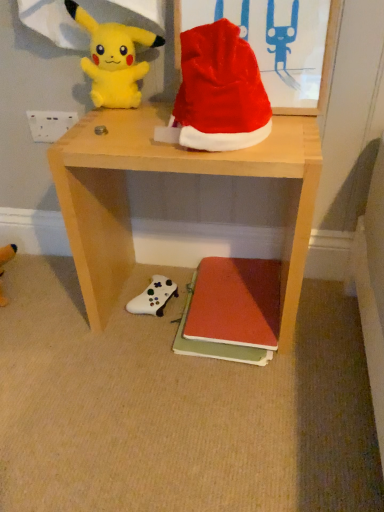
This screenshot has width=384, height=512. What do you see at coordinates (113, 59) in the screenshot? I see `yellow plush toy at upper left, placed as the 1th toy when sorted from front to back` at bounding box center [113, 59].

Describe the element at coordinates (220, 91) in the screenshot. The height and width of the screenshot is (512, 384). I see `shiny fabric santa hat at upper center` at that location.

Measure the distance between point [159,157] and camera.

The distance of point [159,157] from camera is 30.51 inches.

What do you see at coordinates (153, 297) in the screenshot?
I see `white matte game controller at lower center, acting as the second toy starting from the front` at bounding box center [153, 297].

At what (x,y) coordinates should I click in order to perform the action: click on yellow plush toy at upper left, marked as the 1th toy in a top-to-bottom arrangement. Please return your answer as a coordinate pair (x, y). This screenshot has height=512, width=384. Looking at the image, I should click on (113, 59).

Locate an element on the screen. The width and height of the screenshot is (384, 512). book behind the wooden desk at center is located at coordinates (231, 311).

Considering the sizes of wooden desk at center and matte red book at lower center in the image, is wooden desk at center taller or shorter than matte red book at lower center?

In the image, wooden desk at center appears to be taller than matte red book at lower center.

Considering the positions of point (103, 214) and point (278, 303), is point (103, 214) closer or farther from the camera than point (278, 303)?

Point (103, 214) is positioned closer to the camera compared to point (278, 303).

Does wooden desk at center have a smaller size compared to matte red book at lower center?

No, wooden desk at center is not smaller than matte red book at lower center.

Where is `desk in front of the matte red book at lower center`? The width and height of the screenshot is (384, 512). desk in front of the matte red book at lower center is located at coordinates (172, 172).

Does matte red book at lower center have a larger size compared to wooden desk at center?

No.

In the scene shown: Does matte red book at lower center come behind wooden desk at center?

Yes.

Which of these two, matte red book at lower center or wooden desk at center, stands shorter?

Standing shorter between the two is matte red book at lower center.

Are white plastic power outlet at upper left and matte red book at lower center far apart?

No.

Which object is positioned more to the right, white plastic power outlet at upper left or matte red book at lower center?

matte red book at lower center.

Is white plastic power outlet at upper left taller or shorter than matte red book at lower center?

white plastic power outlet at upper left is taller than matte red book at lower center.

Can you confirm if wooden desk at center is smaller than white plastic power outlet at upper left?

No, wooden desk at center is not smaller than white plastic power outlet at upper left.

From the picture: Is wooden desk at center next to white plastic power outlet at upper left and touching it?

No, wooden desk at center is not touching white plastic power outlet at upper left.

Is wooden desk at center aimed at white plastic power outlet at upper left?

No, wooden desk at center is not oriented towards white plastic power outlet at upper left.

This screenshot has height=512, width=384. In the image, there is a white plastic power outlet at upper left. What are the coordinates of `desk below it (from a real-world perspective)` in the screenshot? It's located at click(172, 172).

From the picture: Would you consider wooden desk at center to be distant from yellow plush toy at upper left, marked as the 1th toy in a top-to-bottom arrangement?

No.

Which object is closer to the camera taking this photo, wooden desk at center or yellow plush toy at upper left, placed as the 1th toy when sorted from front to back?

wooden desk at center is in front.

From a real-world perspective, does wooden desk at center sit lower than yellow plush toy at upper left, acting as the 2th toy starting from the bottom?

Indeed, from a real-world perspective, wooden desk at center is positioned beneath yellow plush toy at upper left, acting as the 2th toy starting from the bottom.

Is white plastic power outlet at upper left positioned with its back to white matte game controller at lower center, which ranks as the first toy in bottom-to-top order?

No.

Measure the distance between white plastic power outlet at upper left and white matte game controller at lower center, acting as the second toy starting from the front.

white plastic power outlet at upper left is 19.68 inches from white matte game controller at lower center, acting as the second toy starting from the front.

From the image's perspective, which is below, white plastic power outlet at upper left or white matte game controller at lower center, positioned as the 2th toy in top-to-bottom order?

white matte game controller at lower center, positioned as the 2th toy in top-to-bottom order.

Are white plastic power outlet at upper left and white matte game controller at lower center, which ranks as the first toy in bottom-to-top order, located far from each other?

Actually, white plastic power outlet at upper left and white matte game controller at lower center, which ranks as the first toy in bottom-to-top order, are a little close together.

Is white matte game controller at lower center, which ranks as the first toy in bottom-to-top order, beside wooden desk at center?

No.

Which of these two, white matte game controller at lower center, acting as the second toy starting from the front, or wooden desk at center, is wider?

Wider between the two is wooden desk at center.

Considering the relative sizes of white matte game controller at lower center, which ranks as the first toy in bottom-to-top order, and wooden desk at center in the image provided, is white matte game controller at lower center, which ranks as the first toy in bottom-to-top order, bigger than wooden desk at center?

No.

Is wooden desk at center completely or partially inside white matte game controller at lower center, which ranks as the first toy in bottom-to-top order?

No.

This screenshot has width=384, height=512. Find the location of `book on the right of wooden desk at center`. book on the right of wooden desk at center is located at coordinates (231, 311).

Identify the location of desk above the matte red book at lower center (from a real-world perspective). (172, 172).

When comparing their distances from shiny fabric santa hat at upper center, does white plastic power outlet at upper left or matte red book at lower center seem further?

Among the two, matte red book at lower center is located further to shiny fabric santa hat at upper center.

Consider the image. Based on their spatial positions, is wooden desk at center or shiny fabric santa hat at upper center closer to yellow plush toy at upper left, acting as the 2th toy starting from the bottom?

Among the two, shiny fabric santa hat at upper center is located nearer to yellow plush toy at upper left, acting as the 2th toy starting from the bottom.

Estimate the real-world distances between objects in this image. Which object is closer to yellow plush toy at upper left, acting as the 2th toy starting from the bottom, white plastic power outlet at upper left or matte red book at lower center?

Among the two, white plastic power outlet at upper left is located nearer to yellow plush toy at upper left, acting as the 2th toy starting from the bottom.

Based on their spatial positions, is wooden desk at center or yellow plush toy at upper left, marked as the 1th toy in a top-to-bottom arrangement, closer to matte red book at lower center?

wooden desk at center is positioned closer to the anchor matte red book at lower center.

Consider the image. Looking at the image, which one is located closer to white matte game controller at lower center, acting as the first toy starting from the back, wooden desk at center or yellow plush toy at upper left, marked as the 1th toy in a top-to-bottom arrangement?

Among the two, wooden desk at center is located nearer to white matte game controller at lower center, acting as the first toy starting from the back.

When comparing their distances from matte red book at lower center, does yellow plush toy at upper left, placed as the 1th toy when sorted from front to back, or wooden desk at center seem closer?

Among the two, wooden desk at center is located nearer to matte red book at lower center.

From the image, which object appears to be farther from yellow plush toy at upper left, marked as the 1th toy in a top-to-bottom arrangement, white matte game controller at lower center, acting as the second toy starting from the front, or matte red book at lower center?

matte red book at lower center.

Considering their positions, is yellow plush toy at upper left, acting as the 2th toy starting from the bottom, positioned closer to matte red book at lower center than white plastic power outlet at upper left?

yellow plush toy at upper left, acting as the 2th toy starting from the bottom, is positioned closer to the anchor matte red book at lower center.

Identify the location of toy between yellow plush toy at upper left, placed as the 1th toy when sorted from front to back, and matte red book at lower center from top to bottom. This screenshot has width=384, height=512. (153, 297).

Locate an element on the screen. This screenshot has width=384, height=512. hat between yellow plush toy at upper left, acting as the 2th toy starting from the bottom, and matte red book at lower center in the up-down direction is located at coordinates pyautogui.click(x=220, y=91).

Where is `desk between yellow plush toy at upper left, placed as the 1th toy when sorted from front to back, and white matte game controller at lower center, acting as the first toy starting from the back, vertically`? The height and width of the screenshot is (512, 384). desk between yellow plush toy at upper left, placed as the 1th toy when sorted from front to back, and white matte game controller at lower center, acting as the first toy starting from the back, vertically is located at coordinates (172, 172).

Locate an element on the screen. This screenshot has height=512, width=384. toy between white plastic power outlet at upper left and matte red book at lower center in the up-down direction is located at coordinates (153, 297).